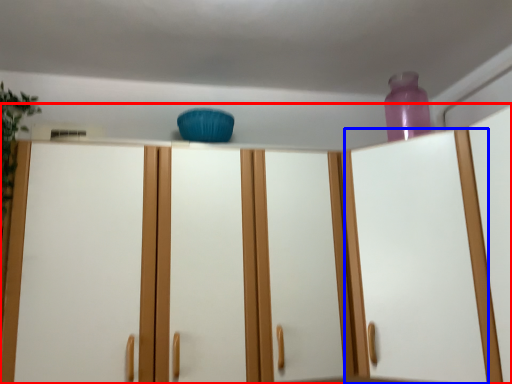
Question: Which object appears farthest to the camera in this image, cupboard (highlighted by a red box) or glass door (highlighted by a blue box)?

Choices:
 (A) cupboard
 (B) glass door

Answer: (B)